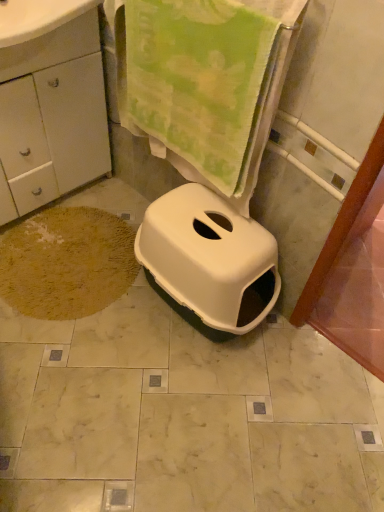
What are the coordinates of `vacant area that lies in front of white plastic litter box at center` in the screenshot? It's located at (176, 398).